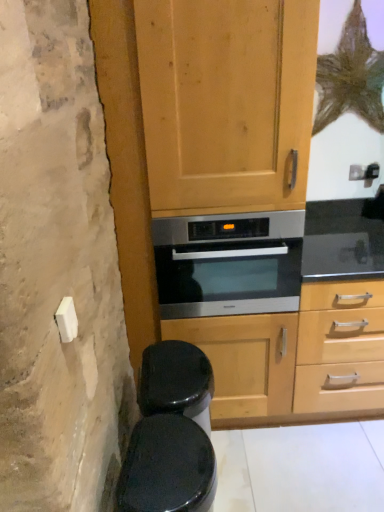
At what (x,y) coordinates should I click in order to perform the action: click on wooden cabinet at center. Please return your answer as a coordinate pair (x, y). The image size is (384, 512). Looking at the image, I should click on (126, 167).

The height and width of the screenshot is (512, 384). Identify the location of black glossy toilet bowl at lower left. (167, 467).

Can you confirm if wooden cabinet at center is bigger than black glossy toilet bowl at lower left?

Correct, wooden cabinet at center is larger in size than black glossy toilet bowl at lower left.

Where is `toilet bowl on the left of the wooden cabinet at center`? toilet bowl on the left of the wooden cabinet at center is located at coordinates (167, 467).

Does wooden cabinet at center come in front of black glossy toilet bowl at lower left?

No, wooden cabinet at center is behind black glossy toilet bowl at lower left.

Between wooden cabinet at center and black glossy toilet bowl at lower left, which one appears on the right side from the viewer's perspective?

Positioned to the right is wooden cabinet at center.

Considering the sizes of black glossy toilet bowl at lower left and wooden cabinet at center in the image, is black glossy toilet bowl at lower left wider or thinner than wooden cabinet at center?

In the image, black glossy toilet bowl at lower left appears to be more narrow than wooden cabinet at center.

From the image's perspective, which one is positioned higher, black glossy toilet bowl at lower left or wooden cabinet at center?

wooden cabinet at center appears higher in the image.

Is black glossy toilet bowl at lower left spatially inside wooden cabinet at center, or outside of it?

black glossy toilet bowl at lower left is outside wooden cabinet at center.

Is wooden cabinet at center oriented away from stainless steel oven at center?

Correct, wooden cabinet at center is looking away from stainless steel oven at center.

Between wooden cabinet at center and stainless steel oven at center, which one appears on the left side from the viewer's perspective?

Positioned to the left is wooden cabinet at center.

Is wooden cabinet at center behind stainless steel oven at center?

No, wooden cabinet at center is closer to the camera.

Does wooden cabinet at center have a greater height compared to stainless steel oven at center?

Indeed, wooden cabinet at center has a greater height compared to stainless steel oven at center.

Considering the relative sizes of stainless steel oven at center and black glossy toilet bowl at lower left in the image provided, is stainless steel oven at center shorter than black glossy toilet bowl at lower left?

Indeed, stainless steel oven at center has a lesser height compared to black glossy toilet bowl at lower left.

In the image, there is a stainless steel oven at center. Where is `toilet bowl below it (from a real-world perspective)`? toilet bowl below it (from a real-world perspective) is located at coordinates (167, 467).

Can you tell me how much stainless steel oven at center and black glossy toilet bowl at lower left differ in facing direction?

89.6 degrees separate the facing orientations of stainless steel oven at center and black glossy toilet bowl at lower left.

Considering the sizes of stainless steel oven at center and black glossy toilet bowl at lower left in the image, is stainless steel oven at center bigger or smaller than black glossy toilet bowl at lower left?

Clearly, stainless steel oven at center is larger in size than black glossy toilet bowl at lower left.

Considering the relative sizes of black glossy toilet bowl at lower left and stainless steel oven at center in the image provided, is black glossy toilet bowl at lower left taller than stainless steel oven at center?

Correct, black glossy toilet bowl at lower left is much taller as stainless steel oven at center.

Measure the distance from black glossy toilet bowl at lower left to stainless steel oven at center.

black glossy toilet bowl at lower left is 66.28 centimeters away from stainless steel oven at center.

From a real-world perspective, who is located lower, black glossy toilet bowl at lower left or stainless steel oven at center?

From a 3D spatial view, black glossy toilet bowl at lower left is below.

Which object is further away from the camera taking this photo, black glossy toilet bowl at lower left or stainless steel oven at center?

stainless steel oven at center is further away from the camera.

Is stainless steel oven at center aimed at wooden cabinet at center?

Yes.

Is stainless steel oven at center positioned far away from wooden cabinet at center?

stainless steel oven at center is near wooden cabinet at center, not far away.

Which of these two, stainless steel oven at center or wooden cabinet at center, stands shorter?

With less height is stainless steel oven at center.

Is stainless steel oven at center wider than wooden cabinet at center?

No, stainless steel oven at center is not wider than wooden cabinet at center.

Where is `dresser behind the black glossy toilet bowl at lower left`? This screenshot has width=384, height=512. dresser behind the black glossy toilet bowl at lower left is located at coordinates (126, 167).

In the image, there is a wooden cabinet at center. Where is `toilet bowl below it (from a real-world perspective)`? toilet bowl below it (from a real-world perspective) is located at coordinates (167, 467).

From the image, which object appears to be nearer to wooden cabinet at center, black glossy toilet bowl at lower left or stainless steel oven at center?

stainless steel oven at center.

Consider the image. When comparing their distances from black glossy toilet bowl at lower left, does stainless steel oven at center or wooden cabinet at center seem closer?

stainless steel oven at center is positioned closer to the anchor black glossy toilet bowl at lower left.

Based on their spatial positions, is stainless steel oven at center or black glossy toilet bowl at lower left closer to wooden cabinet at center?

stainless steel oven at center lies closer to wooden cabinet at center than the other object.

Considering their positions, is wooden cabinet at center positioned closer to black glossy toilet bowl at lower left than stainless steel oven at center?

Among the two, stainless steel oven at center is located nearer to black glossy toilet bowl at lower left.

From the image, which object appears to be farther from stainless steel oven at center, wooden cabinet at center or black glossy toilet bowl at lower left?

black glossy toilet bowl at lower left lies further to stainless steel oven at center than the other object.

When comparing their distances from stainless steel oven at center, does black glossy toilet bowl at lower left or wooden cabinet at center seem closer?

wooden cabinet at center is closer to stainless steel oven at center.

This screenshot has height=512, width=384. Find the location of `oven between wooden cabinet at center and black glossy toilet bowl at lower left in the vertical direction`. oven between wooden cabinet at center and black glossy toilet bowl at lower left in the vertical direction is located at coordinates (228, 264).